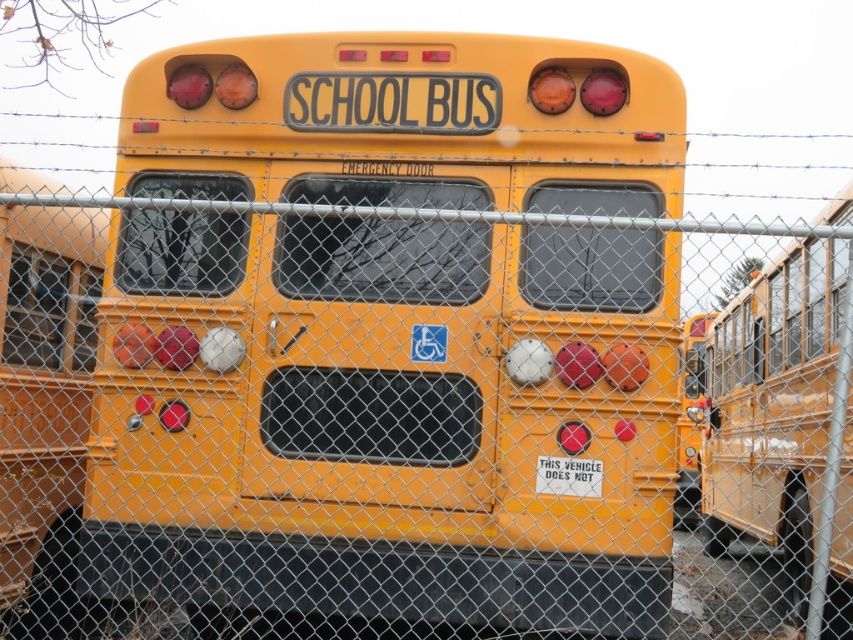
You are a delivery person trying to deliver a package to the white paper sign at center. The matte yellow school bus at right is blocking your path. Can you go under the school bus to reach the sign?

The matte yellow school bus at right is much taller than the white paper sign at center, so you can go under the school bus to reach the white paper sign at center.